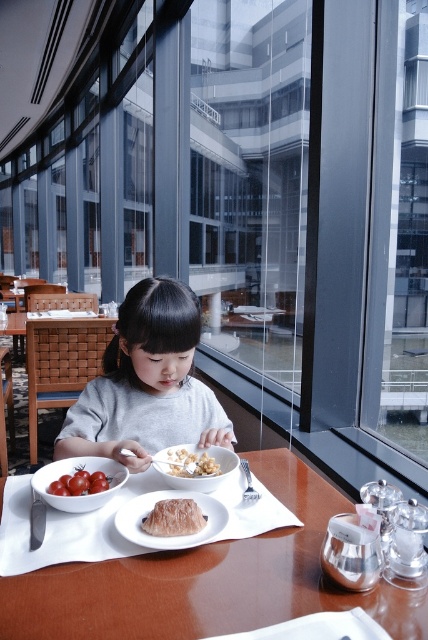
Who is shorter, gray matte shirt at center or white crumbly bread at center?

Standing shorter between the two is white crumbly bread at center.

Who is higher up, gray matte shirt at center or white crumbly bread at center?

gray matte shirt at center is above.

Who is more distant from viewer, (199, 406) or (208, 472)?

The point (199, 406) is behind.

The height and width of the screenshot is (640, 428). In order to click on gray matte shirt at center in this screenshot , I will do `click(146, 384)`.

Which of these two, gray matte shirt at center or translucent gelatinous food at center, stands shorter?

Standing shorter between the two is translucent gelatinous food at center.

Who is taller, gray matte shirt at center or translucent gelatinous food at center?

With more height is gray matte shirt at center.

Is point (133, 348) positioned after point (180, 525)?

Yes, point (133, 348) is behind point (180, 525).

Where is `gray matte shirt at center`? The height and width of the screenshot is (640, 428). gray matte shirt at center is located at coordinates (146, 384).

Looking at this image, does white glossy plate at center appear on the left side of translucent gelatinous food at center?

Yes, white glossy plate at center is to the left of translucent gelatinous food at center.

Locate an element on the screen. The height and width of the screenshot is (640, 428). white glossy plate at center is located at coordinates (169, 536).

This screenshot has height=640, width=428. I want to click on white glossy plate at center, so click(x=169, y=536).